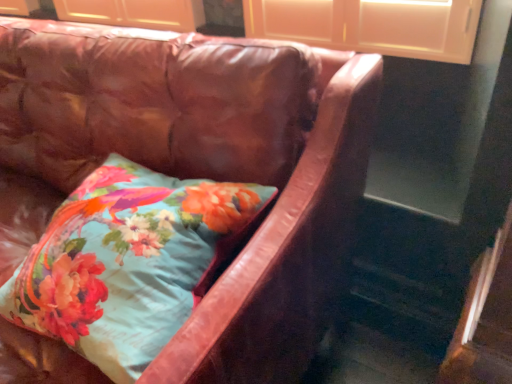
Question: From the image's perspective, is leather couch at center on top of floral fabric pillow at center?

Choices:
 (A) yes
 (B) no

Answer: (A)

Question: Is leather couch at center completely or partially outside of floral fabric pillow at center?

Choices:
 (A) yes
 (B) no

Answer: (A)

Question: Does leather couch at center have a larger size compared to floral fabric pillow at center?

Choices:
 (A) no
 (B) yes

Answer: (B)

Question: Can you confirm if leather couch at center is shorter than floral fabric pillow at center?

Choices:
 (A) yes
 (B) no

Answer: (B)

Question: From the image's perspective, is leather couch at center beneath floral fabric pillow at center?

Choices:
 (A) yes
 (B) no

Answer: (B)

Question: From a real-world perspective, is leather couch at center located higher than floral fabric pillow at center?

Choices:
 (A) no
 (B) yes

Answer: (A)

Question: Is floral fabric pillow at center wider than leather couch at center?

Choices:
 (A) yes
 (B) no

Answer: (B)

Question: Considering the relative sizes of floral fabric pillow at center and leather couch at center in the image provided, is floral fabric pillow at center bigger than leather couch at center?

Choices:
 (A) yes
 (B) no

Answer: (B)

Question: From the image's perspective, does floral fabric pillow at center appear higher than leather couch at center?

Choices:
 (A) yes
 (B) no

Answer: (B)

Question: From a real-world perspective, is floral fabric pillow at center on leather couch at center?

Choices:
 (A) no
 (B) yes

Answer: (B)

Question: Is floral fabric pillow at center facing towards leather couch at center?

Choices:
 (A) yes
 (B) no

Answer: (A)

Question: Does floral fabric pillow at center have a lesser width compared to leather couch at center?

Choices:
 (A) yes
 (B) no

Answer: (A)

Question: Considering the positions of leather couch at center and floral fabric pillow at center in the image, is leather couch at center wider or thinner than floral fabric pillow at center?

Choices:
 (A) wide
 (B) thin

Answer: (A)